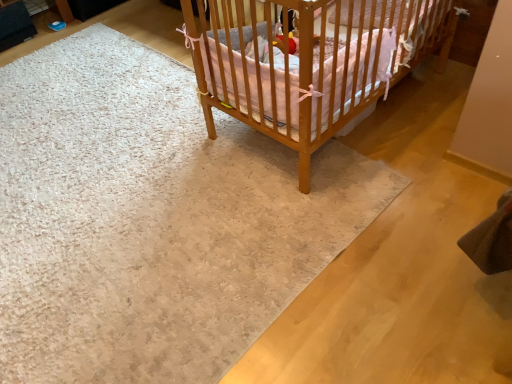
Image resolution: width=512 pixels, height=384 pixels. Describe the element at coordinates (310, 63) in the screenshot. I see `wooden crib at upper right` at that location.

The height and width of the screenshot is (384, 512). Identify the location of wooden crib at upper right. 310,63.

The width and height of the screenshot is (512, 384). I want to click on wooden crib at upper right, so click(x=310, y=63).